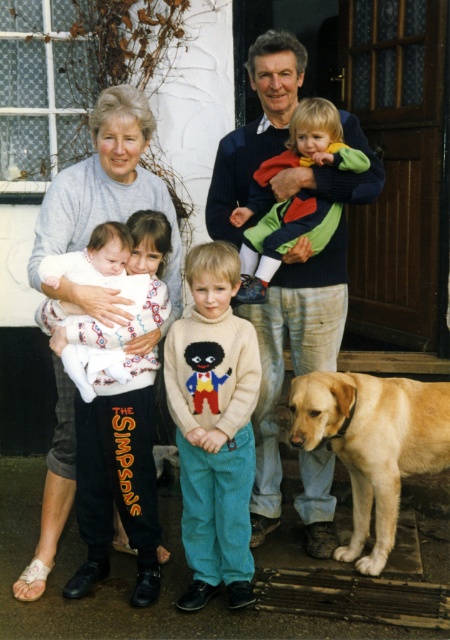
Where is `knitted sweater at center`? knitted sweater at center is located at coordinates (214, 426).

From the picture: Is knitted sweater at center to the right of gray sweater at left from the viewer's perspective?

Yes, knitted sweater at center is to the right of gray sweater at left.

This screenshot has width=450, height=640. In order to click on knitted sweater at center in this screenshot , I will do `click(214, 426)`.

Who is taller, gray sweater at left or golden fur dog at lower right?

With more height is gray sweater at left.

Measure the distance between point [98,216] and camera.

Point [98,216] is 3.64 meters from camera.

The height and width of the screenshot is (640, 450). Identify the location of gray sweater at left. (107, 204).

Consider the image. Can you confirm if light brown fur dog at center is positioned above knitted sweater at center?

Yes.

Is light brown fur dog at center bigger than knitted sweater at center?

Yes, light brown fur dog at center is bigger than knitted sweater at center.

Between point (283, 198) and point (184, 324), which one is positioned behind?

The point (283, 198) is behind.

The width and height of the screenshot is (450, 640). I want to click on light brown fur dog at center, so click(x=293, y=349).